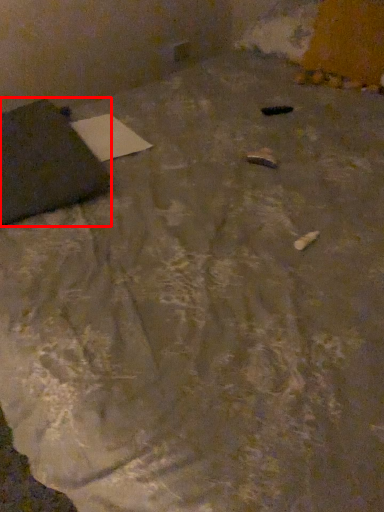
Question: From the image, what is the correct spatial relationship of furniture (annotated by the red box) in relation to notepad?

Choices:
 (A) right
 (B) left

Answer: (B)